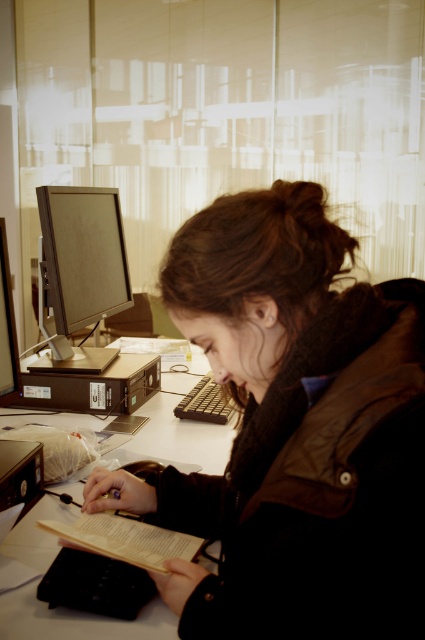
Does matte black monitor at left have a greater width compared to light brown paper book at lower center?

Incorrect, matte black monitor at left's width does not surpass light brown paper book at lower center's.

Is matte black monitor at left above light brown paper book at lower center?

Correct, matte black monitor at left is located above light brown paper book at lower center.

Identify the location of matte black monitor at left. (79, 262).

The width and height of the screenshot is (425, 640). Find the location of `matte black monitor at left`. matte black monitor at left is located at coordinates (79, 262).

Between dark brown knit scarf at center and matte black monitor at left, which one appears on the right side from the viewer's perspective?

dark brown knit scarf at center is more to the right.

Does dark brown knit scarf at center have a lesser height compared to matte black monitor at left?

No.

Is point (269, 582) positioned after point (85, 364)?

No, (269, 582) is in front of (85, 364).

Find the location of a particular element. dark brown knit scarf at center is located at coordinates point(292,433).

Is dark brown knit scarf at center closer to camera compared to white plastic computer desk at center?

Yes, it is in front of white plastic computer desk at center.

Who is taller, dark brown knit scarf at center or white plastic computer desk at center?

dark brown knit scarf at center is taller.

The height and width of the screenshot is (640, 425). I want to click on dark brown knit scarf at center, so click(292, 433).

Where is `dark brown knit scarf at center`? The image size is (425, 640). dark brown knit scarf at center is located at coordinates (292, 433).